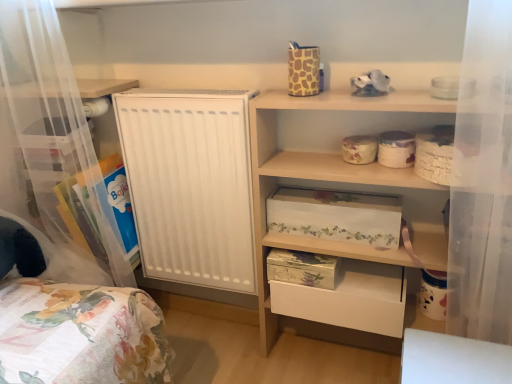
Question: Is point (52, 97) closer or farther from the camera than point (327, 284)?

Choices:
 (A) farther
 (B) closer

Answer: (A)

Question: Looking at their shapes, would you say clear plastic storage at left, which is the second shelf from right to left, is wider or thinner than floral paper storage box at lower center, which is the 1th storage box from bottom to top?

Choices:
 (A) thin
 (B) wide

Answer: (B)

Question: Which of these objects is positioned closest to the white matte drawer at lower center?

Choices:
 (A) floral-patterned cardboard box at upper center, the third storage box ordered from the bottom
 (B) floral paper storage box at lower center, which is counted as the third storage box, starting from the top
 (C) wooden shelf at upper right, marked as the first shelf in a right-to-left arrangement
 (D) floral-patterned cardboard box at center, the second storage box positioned from the top
 (E) clear plastic storage at left, which is the second shelf from right to left

Answer: (B)

Question: Based on their relative distances, which object is nearer to the white matte drawer at lower center?

Choices:
 (A) floral paper storage box at lower center, which is counted as the third storage box, starting from the top
 (B) floral-patterned cardboard box at center, which is the second storage box in bottom-to-top order
 (C) floral-patterned cardboard box at upper center, the third storage box ordered from the bottom
 (D) wooden shelf at upper right, arranged as the 2th shelf when viewed from the left
 (E) clear plastic storage at left, which is the second shelf from right to left

Answer: (A)